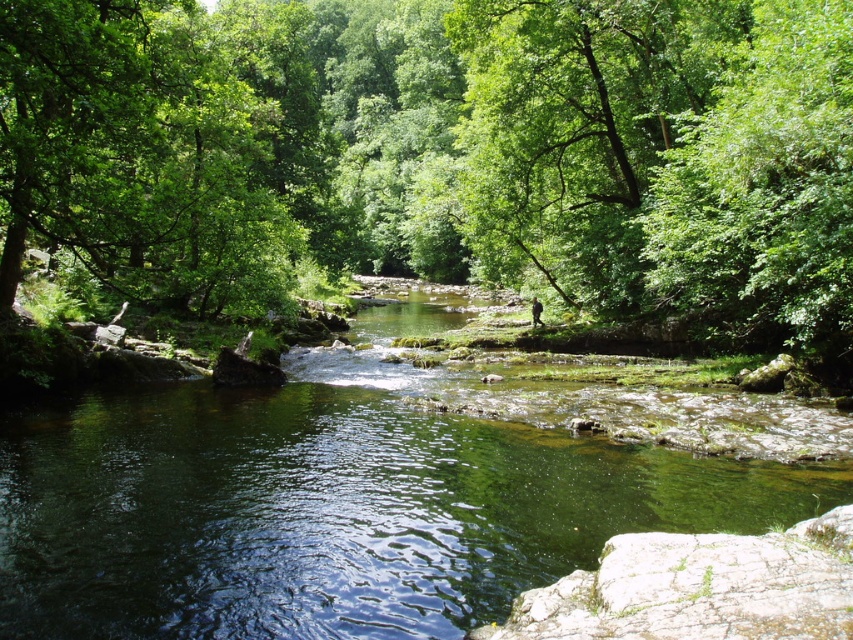
Question: Is green leafy forest at center further to the viewer compared to green leafy tree at upper right?

Choices:
 (A) yes
 (B) no

Answer: (B)

Question: Estimate the real-world distances between objects in this image. Which object is closer to the camouflage fabric man at center?

Choices:
 (A) green leafy tree at center
 (B) green smooth water at center
 (C) green leafy tree at upper right

Answer: (A)

Question: Is green leafy forest at center bigger than green leafy tree at center?

Choices:
 (A) no
 (B) yes

Answer: (B)

Question: Which object is the farthest from the green leafy tree at upper right?

Choices:
 (A) camouflage fabric man at center
 (B) green leafy forest at center
 (C) green smooth water at center

Answer: (B)

Question: Considering the real-world distances, which object is farthest from the green leafy forest at center?

Choices:
 (A) green leafy tree at upper right
 (B) camouflage fabric man at center

Answer: (B)

Question: Can you confirm if green smooth water at center is positioned below green leafy tree at upper right?

Choices:
 (A) no
 (B) yes

Answer: (B)